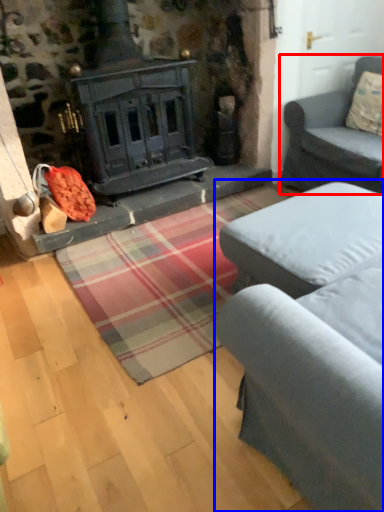
Question: Which point is further to the camera, studio couch (highlighted by a red box) or studio couch (highlighted by a blue box)?

Choices:
 (A) studio couch
 (B) studio couch

Answer: (A)